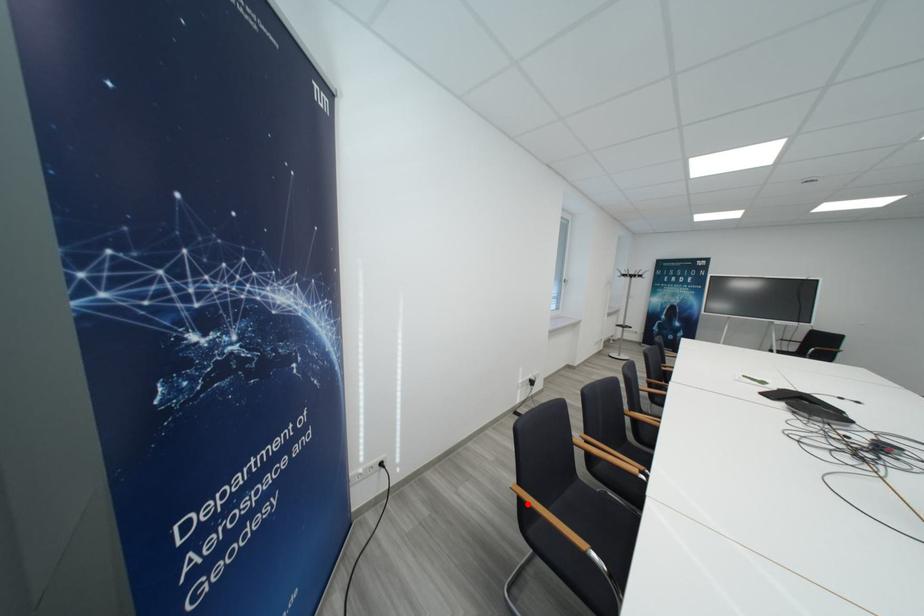
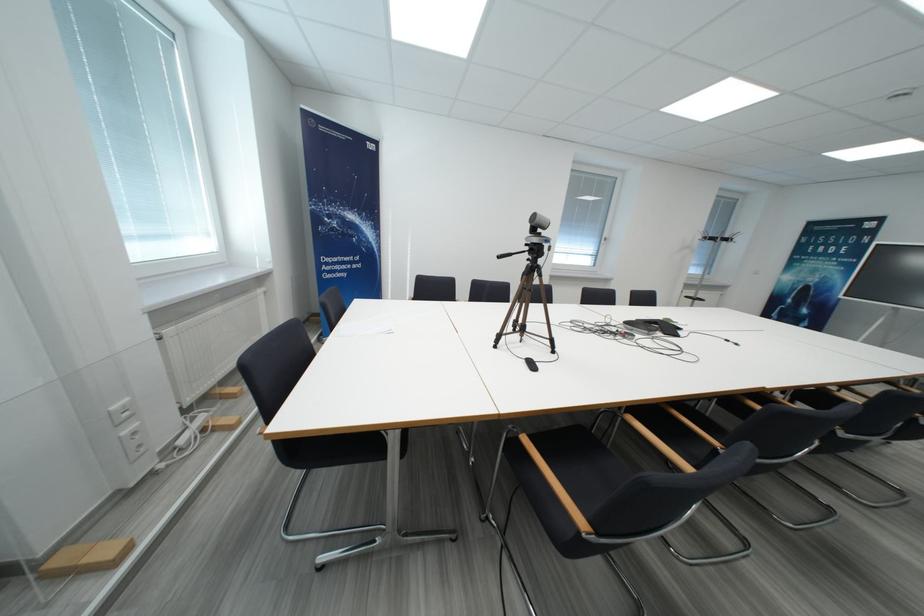
Question: I am providing you with two images of the same scene from different viewpoints. A red point is marked on the first image. Is the red point's position out of view in image 2?

Choices:
 (A) Yes
 (B) No

Answer: (A)